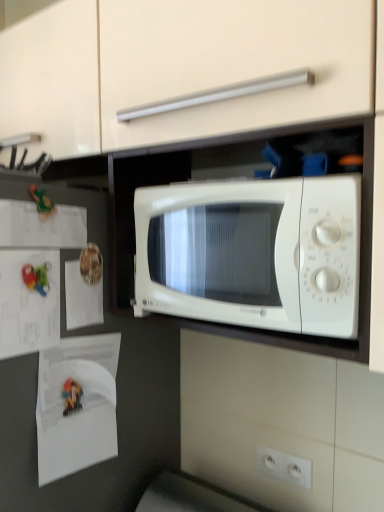
Question: Is point pos(67,350) closer or farther from the camera than point pos(59,229)?

Choices:
 (A) closer
 (B) farther

Answer: (B)

Question: Is white paper at left, the 1th paper in the bottom-to-top sequence, to the left or to the right of white paper at left, marked as the 1th paper in a top-to-bottom arrangement, in the image?

Choices:
 (A) left
 (B) right

Answer: (B)

Question: Based on their relative distances, which object is nearer to the white paper at left, marked as the 4th paper in a bottom-to-top arrangement?

Choices:
 (A) white plastic electric outlet at lower center
 (B) white paper at left, which is the 3th paper from top to bottom
 (C) white paper at left, which is the 2th paper in top-to-bottom order
 (D) green rubber toy at left
 (E) white matte microwave at center

Answer: (D)

Question: Which of these objects is positioned closest to the white paper at left, marked as the 1th paper in a top-to-bottom arrangement?

Choices:
 (A) white paper at left, the 4th paper positioned from the top
 (B) white plastic electric outlet at lower center
 (C) white paper at left, arranged as the third paper when ordered from the bottom
 (D) white matte microwave at center
 (E) green rubber toy at left

Answer: (E)